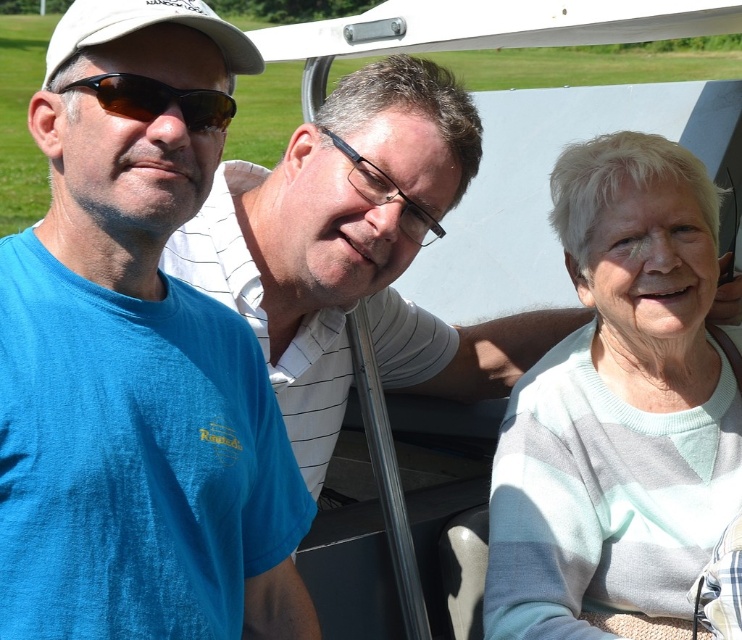
You are a photographer standing in front of the aircraft. You want to take a picture of both the white knit sweater at right and the brown reflective sunglasses at left. Which object should you focus on first to ensure both are in sharp focus?

You should focus on the white knit sweater at right first because it is closer to you than the brown reflective sunglasses at left, so adjusting focus from near to far will help both be in focus.